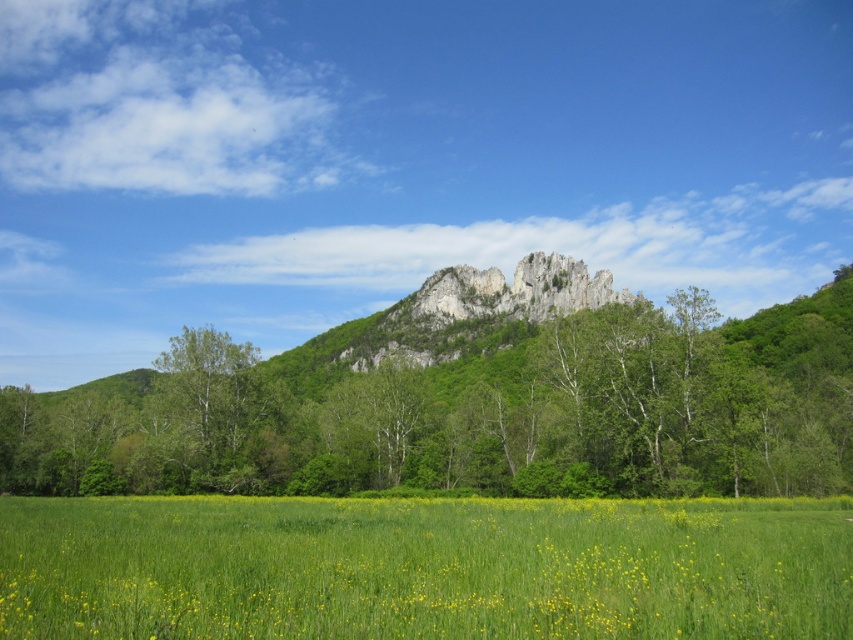
Question: Which object appears farthest from the camera in this image?

Choices:
 (A) green leafy tree at center
 (B) green grass at lower center
 (C) green leafy tree at left

Answer: (C)

Question: Can you confirm if green grass at lower center is bigger than green leafy tree at left?

Choices:
 (A) no
 (B) yes

Answer: (B)

Question: Can you confirm if green grass at lower center is smaller than green leafy tree at left?

Choices:
 (A) yes
 (B) no

Answer: (B)

Question: Based on their relative distances, which object is nearer to the green leafy tree at left?

Choices:
 (A) green leafy tree at center
 (B) green grass at lower center

Answer: (A)

Question: Which point is farther from the camera taking this photo?

Choices:
 (A) 62,420
 (B) 247,387

Answer: (A)

Question: Can you confirm if green leafy tree at center is positioned above green grass at lower center?

Choices:
 (A) no
 (B) yes

Answer: (B)